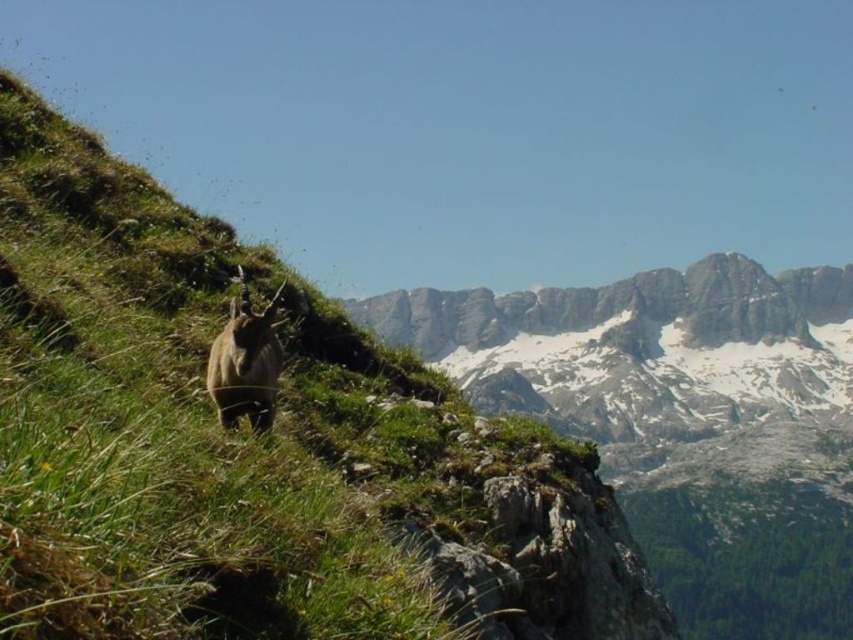
Who is positioned more to the left, green grassy hillside at center or brown furry goat at center?

brown furry goat at center is more to the left.

Between green grassy hillside at center and brown furry goat at center, which one appears on the right side from the viewer's perspective?

green grassy hillside at center is more to the right.

Is point (114, 250) closer to viewer compared to point (279, 358)?

No, (114, 250) is behind (279, 358).

At what (x,y) coordinates should I click in order to perform the action: click on green grassy hillside at center. Please return your answer as a coordinate pair (x, y). The image size is (853, 640). Looking at the image, I should click on (254, 448).